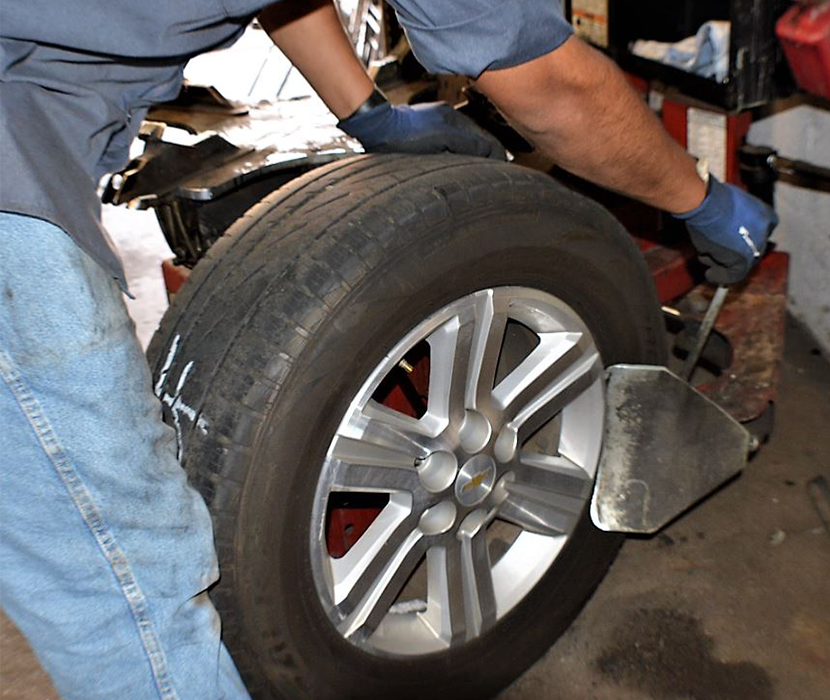
Identify the location of red bin. (804, 36).